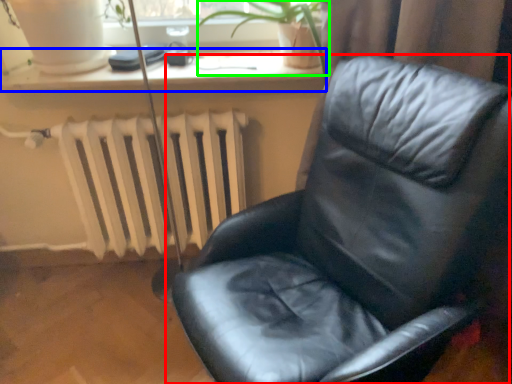
Question: Based on their relative distances, which object is farther from chair (highlighted by a red box)? Choose from window sill (highlighted by a blue box) and plant (highlighted by a green box).

Choices:
 (A) window sill
 (B) plant

Answer: (A)